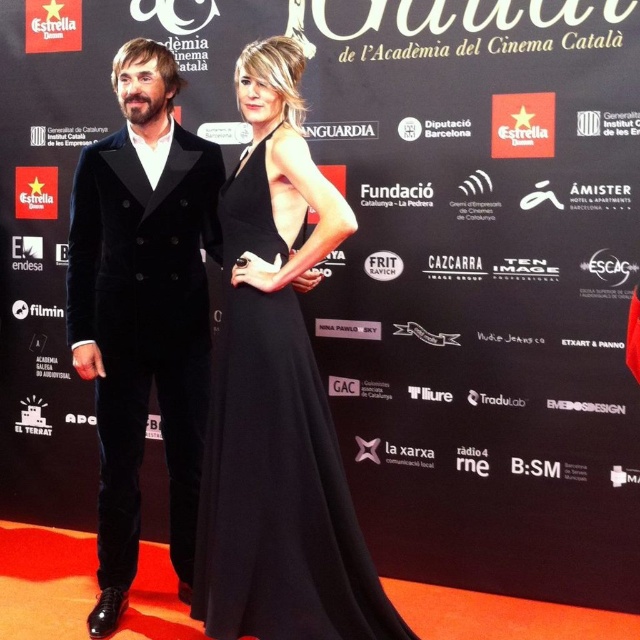
You are a photographer at the event and want to position yourself to capture the velvet black suit at left in the center of your frame. Given the current coordinates, how far to the right or left should you move your camera to center the subject?

The velvet black suit at left is located at coordinates 0.486 on the x and 0.225 on the y. To center it horizontally, move the camera so that the x coordinate aligns with 0.5. Since 0.486 is slightly left of 0.5, move the camera to the right by 0.015 units to center the subject.

You are a photographer at the event. You want to capture a photo that includes both the velvet black suit at left and the black satin dress at center. Which of the two should be positioned closer to the camera to ensure both are in focus?

The velvet black suit at left should be positioned closer to the camera because the black satin dress at center is behind velvet black suit at left, so moving the suit forward would ensure both are in focus.

You are attending a formal event and see two guests dressed in a velvet black suit at left and a black satin dress at center. Which guest is positioned more to the left side of the scene?

The velvet black suit at left is positioned more to the left side of the scene than the black satin dress at center.